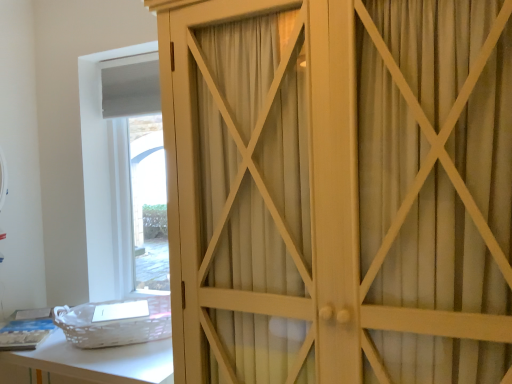
The height and width of the screenshot is (384, 512). Describe the element at coordinates (339, 190) in the screenshot. I see `white wood cupboard at center` at that location.

What is the approximate width of white wood cupboard at center?

The width of white wood cupboard at center is 23.09 inches.

Locate an element on the screen. This screenshot has width=512, height=384. white wood cupboard at center is located at coordinates (339, 190).

What do you see at coordinates (89, 363) in the screenshot?
I see `white wicker basket at lower left` at bounding box center [89, 363].

This screenshot has height=384, width=512. Identify the location of white wicker basket at lower left. (89, 363).

Where is `white wood cupboard at center`? The width and height of the screenshot is (512, 384). white wood cupboard at center is located at coordinates (339, 190).

Based on their positions, is white wicker basket at lower left located to the left or right of white wood cupboard at center?

Clearly, white wicker basket at lower left is on the left of white wood cupboard at center in the image.

Between white wicker basket at lower left and white wood cupboard at center, which one is positioned behind?

white wicker basket at lower left.

Between point (35, 380) and point (267, 217), which one is positioned in front?

The point (267, 217) is closer.

From the image's perspective, relative to white wood cupboard at center, is white wicker basket at lower left above or below?

white wicker basket at lower left is below white wood cupboard at center.

From a real-world perspective, is white wicker basket at lower left physically located above or below white wood cupboard at center?

From a real-world perspective, white wicker basket at lower left is physically below white wood cupboard at center.

Does white wicker basket at lower left have a lesser width compared to white wood cupboard at center?

Yes, white wicker basket at lower left is thinner than white wood cupboard at center.

Can you confirm if white wicker basket at lower left is taller than white wood cupboard at center?

Incorrect, the height of white wicker basket at lower left is not larger of that of white wood cupboard at center.

Considering the sizes of objects white wicker basket at lower left and white wood cupboard at center in the image provided, who is smaller, white wicker basket at lower left or white wood cupboard at center?

Result: With smaller size is white wicker basket at lower left.

Would you say white wicker basket at lower left contains white wood cupboard at center?

No.

Are white wicker basket at lower left and white wood cupboard at center beside each other?

No, white wicker basket at lower left is not making contact with white wood cupboard at center.

Is white wicker basket at lower left facing towards white wood cupboard at center?

No, white wicker basket at lower left is not turned towards white wood cupboard at center.

Can you tell me how much white wicker basket at lower left and white wood cupboard at center differ in facing direction?

1.43 degrees.

Locate an element on the screen. This screenshot has height=384, width=512. cupboard positioned vertically above the white wicker basket at lower left (from a real-world perspective) is located at coordinates (339, 190).

Does white wood cupboard at center appear on the right side of white wicker basket at lower left?

Correct, you'll find white wood cupboard at center to the right of white wicker basket at lower left.

Which is in front, white wood cupboard at center or white wicker basket at lower left?

white wood cupboard at center is in front.

Considering the positions of points (206, 163) and (159, 340), is point (206, 163) farther from camera compared to point (159, 340)?

No, it is in front of (159, 340).

From the image's perspective, does white wood cupboard at center appear lower than white wicker basket at lower left?

No, from the image's perspective, white wood cupboard at center is not below white wicker basket at lower left.

From a real-world perspective, is white wood cupboard at center physically located above or below white wicker basket at lower left?

From a real-world perspective, white wood cupboard at center is physically above white wicker basket at lower left.

Looking at this image, is white wood cupboard at center wider than white wicker basket at lower left?

Correct, the width of white wood cupboard at center exceeds that of white wicker basket at lower left.

In terms of height, does white wood cupboard at center look taller or shorter compared to white wicker basket at lower left?

In the image, white wood cupboard at center appears to be taller than white wicker basket at lower left.

Does white wood cupboard at center have a smaller size compared to white wicker basket at lower left?

Actually, white wood cupboard at center might be larger than white wicker basket at lower left.

Would you say white wood cupboard at center is inside or outside white wicker basket at lower left?

white wood cupboard at center is not inside white wicker basket at lower left, it's outside.

In the scene shown: Is white wood cupboard at center next to white wicker basket at lower left and touching it?

No, white wood cupboard at center is not with white wicker basket at lower left.

Is white wood cupboard at center aimed at white wicker basket at lower left?

No, white wood cupboard at center is not aimed at white wicker basket at lower left.

How far apart are white wood cupboard at center and white wicker basket at lower left?

white wood cupboard at center is 28.83 inches away from white wicker basket at lower left.

This screenshot has width=512, height=384. I want to click on cupboard on the right of white wicker basket at lower left, so click(339, 190).

The height and width of the screenshot is (384, 512). Find the location of `vanity behind the white wood cupboard at center`. vanity behind the white wood cupboard at center is located at coordinates tap(89, 363).

Locate an element on the screen. The width and height of the screenshot is (512, 384). cupboard above the white wicker basket at lower left (from a real-world perspective) is located at coordinates (339, 190).